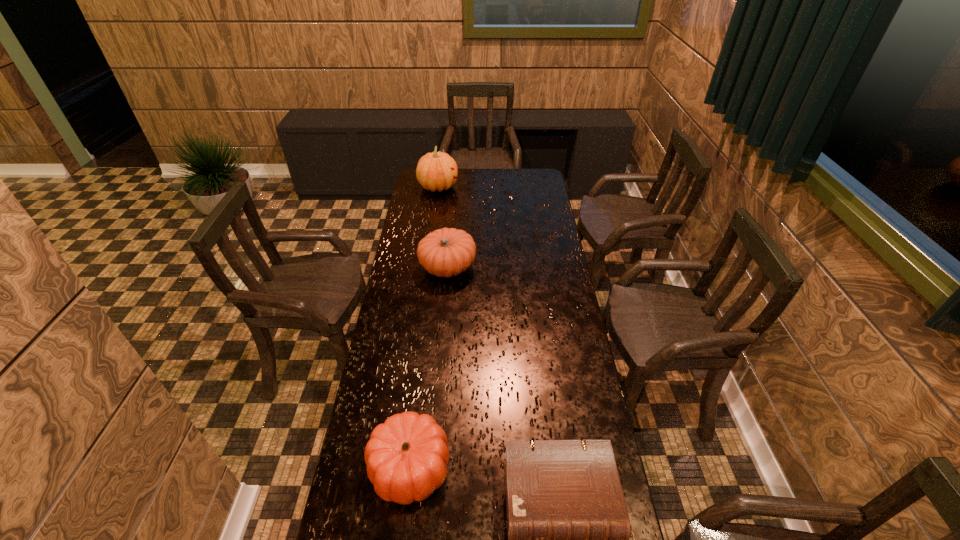
The width and height of the screenshot is (960, 540). In order to click on vacant space at the left edge in this screenshot , I will do `click(419, 205)`.

Where is `free point at the right edge`? free point at the right edge is located at coordinates (588, 409).

Locate an element on the screen. This screenshot has width=960, height=540. free space between the second farthest pumpkin and the farthest object is located at coordinates (443, 227).

Locate an element on the screen. This screenshot has width=960, height=540. free space that is in between the farthest pumpkin and the nearest pumpkin is located at coordinates (423, 327).

What are the coordinates of `free spot between the second nearest pumpkin and the nearest pumpkin` in the screenshot? It's located at (428, 367).

At what (x,y) coordinates should I click in order to perform the action: click on object that ranks as the third closest to the farthest pumpkin. Please return your answer as a coordinate pair (x, y). Looking at the image, I should click on [568, 527].

Locate which object ranks second in proximity to the farthest object. Please provide its 2D coordinates. Your answer should be formatted as a tuple, i.e. [(x, y)], where the tuple contains the x and y coordinates of a point satisfying the conditions above.

[(407, 455)]

Locate an element on the screen. the closest pumpkin to the farthest pumpkin is located at coordinates (447, 252).

Identify which pumpkin is located as the second nearest to the nearest pumpkin. Please provide its 2D coordinates. Your answer should be formatted as a tuple, i.e. [(x, y)], where the tuple contains the x and y coordinates of a point satisfying the conditions above.

[(435, 171)]

At what (x,y) coordinates should I click in order to perform the action: click on free spot that satisfies the following two spatial constraints: 1. on the carved face of the second farthest object; 2. on the right side of the farthest pumpkin. Please return your answer as a coordinate pair (x, y). The width and height of the screenshot is (960, 540). Looking at the image, I should click on (427, 267).